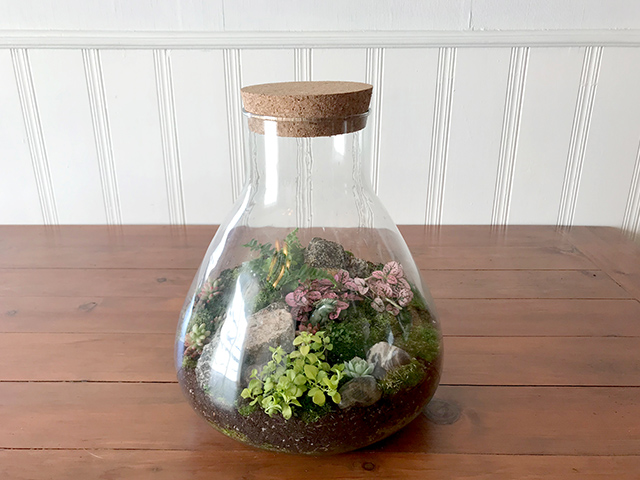
At what (x,y) coordinates should I click in order to perform the action: click on cork. Please return your answer as a coordinate pair (x, y). The image size is (640, 480). Looking at the image, I should click on pyautogui.click(x=323, y=103).